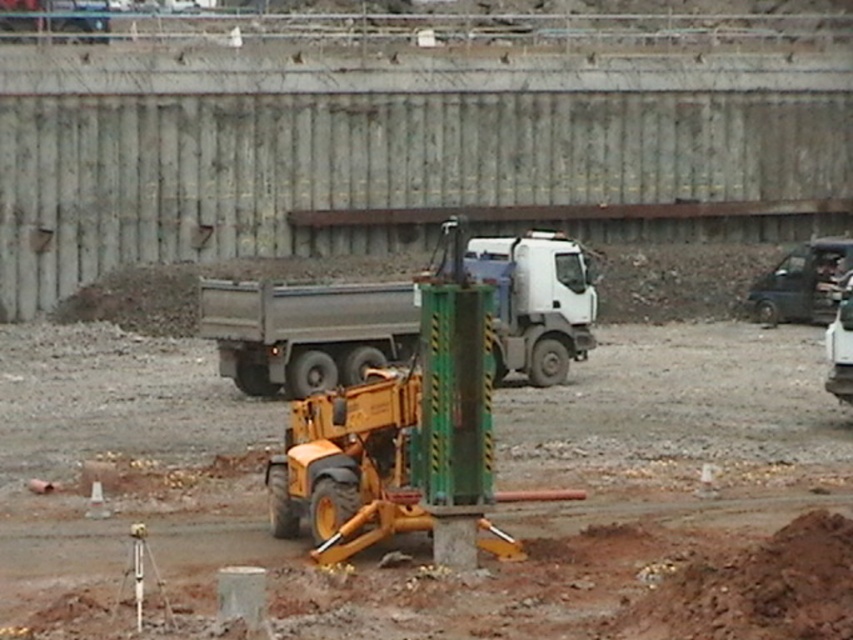
Does gray metallic trailer truck at center have a lesser width compared to black fabric construction worker at right?

In fact, gray metallic trailer truck at center might be wider than black fabric construction worker at right.

Can you confirm if gray metallic trailer truck at center is positioned below black fabric construction worker at right?

Correct, gray metallic trailer truck at center is located below black fabric construction worker at right.

Between point (576, 284) and point (836, 266), which one is positioned behind?

Positioned behind is point (836, 266).

Locate an element on the screen. This screenshot has width=853, height=640. gray metallic trailer truck at center is located at coordinates (305, 332).